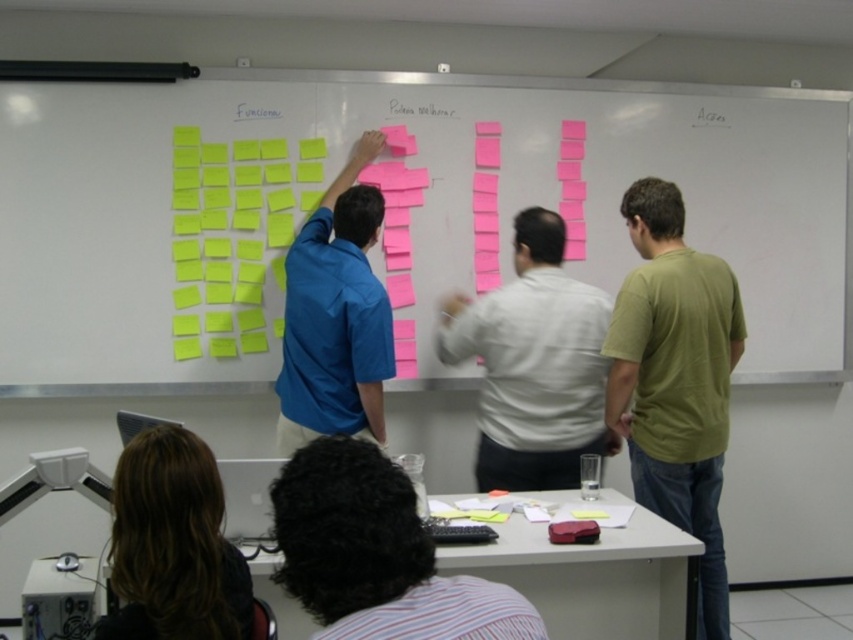
Question: Which of these objects is positioned farthest from the green matte t-shirt at right?

Choices:
 (A) white paper at upper center
 (B) white matte shirt at center
 (C) pink paper notes at upper center
 (D) blue matte shirt at center

Answer: (A)

Question: Which of these objects is positioned farthest from the dark brown hair at lower left?

Choices:
 (A) blue matte shirt at center
 (B) white matte shirt at center
 (C) striped cotton shirt at lower center

Answer: (B)

Question: Among these objects, which one is farthest from the camera?

Choices:
 (A) green matte t-shirt at right
 (B) dark brown hair at lower left
 (C) striped cotton shirt at lower center

Answer: (A)

Question: Does striped cotton shirt at lower center lie behind blue matte shirt at center?

Choices:
 (A) yes
 (B) no

Answer: (B)

Question: Does pink paper notes at upper center lie in front of white matte shirt at center?

Choices:
 (A) no
 (B) yes

Answer: (A)

Question: Can you confirm if white matte shirt at center is smaller than dark brown hair at lower left?

Choices:
 (A) no
 (B) yes

Answer: (A)